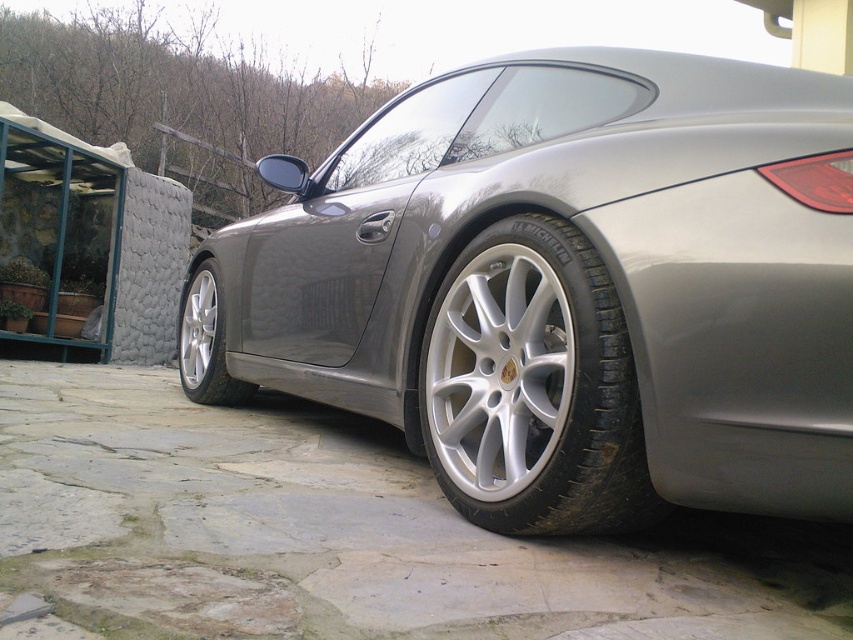
Question: Which of the following is the farthest from the observer?

Choices:
 (A) silver metallic wheel at lower left
 (B) gray stone driveway at lower center
 (C) silver metallic tire at lower center

Answer: (A)

Question: Is gray stone driveway at lower center thinner than silver metallic rim at center?

Choices:
 (A) yes
 (B) no

Answer: (B)

Question: Which object is closer to the camera taking this photo?

Choices:
 (A) silver metallic tire at lower center
 (B) satin silver car at center

Answer: (B)

Question: Is the position of satin silver car at center more distant than that of silver metallic tire at lower center?

Choices:
 (A) no
 (B) yes

Answer: (A)

Question: Which of these objects is positioned farthest from the satin silver car at center?

Choices:
 (A) gray stone driveway at lower center
 (B) silver metallic tire at lower center

Answer: (A)

Question: Is silver metallic wheel at lower left behind silver metallic rim at center?

Choices:
 (A) no
 (B) yes

Answer: (A)